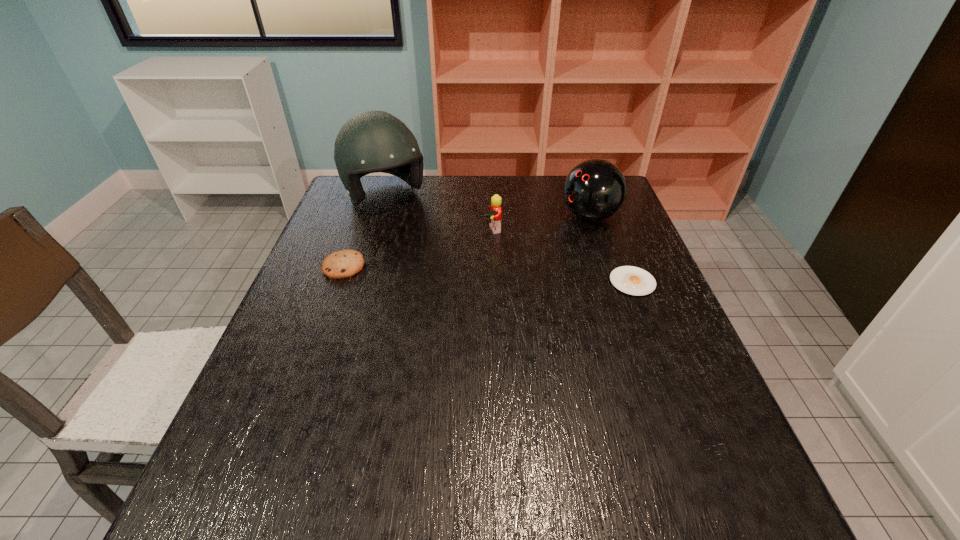
Where is `empty space between the egg yolk and the football helmet`? The image size is (960, 540). empty space between the egg yolk and the football helmet is located at coordinates (509, 240).

In order to click on unoccupied area between the Lego and the shortest object in this screenshot , I will do `click(561, 256)`.

Where is `blank region between the tallest object and the third object from left to right`? blank region between the tallest object and the third object from left to right is located at coordinates (437, 214).

The height and width of the screenshot is (540, 960). I want to click on vacant area that lies between the egg yolk and the fourth shortest object, so click(x=611, y=249).

In order to click on unoccupied area between the shortest object and the cookie in this screenshot , I will do `click(488, 274)`.

At what (x,y) coordinates should I click in order to perform the action: click on vacant area that lies between the tallest object and the second tallest object. Please return your answer as a coordinate pair (x, y). The height and width of the screenshot is (540, 960). Looking at the image, I should click on (488, 207).

You are a GUI agent. You are given a task and a screenshot of the screen. Output one action in this format:
    pyautogui.click(x=<x>, y=<y>)
    Task: Click on the vacant region between the Lego and the tallest object
    
    Given the screenshot: What is the action you would take?
    pyautogui.click(x=437, y=214)

This screenshot has width=960, height=540. What are the coordinates of `empty space between the cookie and the egg yolk` in the screenshot? It's located at (488, 274).

Image resolution: width=960 pixels, height=540 pixels. I want to click on vacant space that is in between the third object from right to left and the shortest object, so click(x=561, y=256).

Identify the location of the fourth closest object to the cookie. (631, 280).